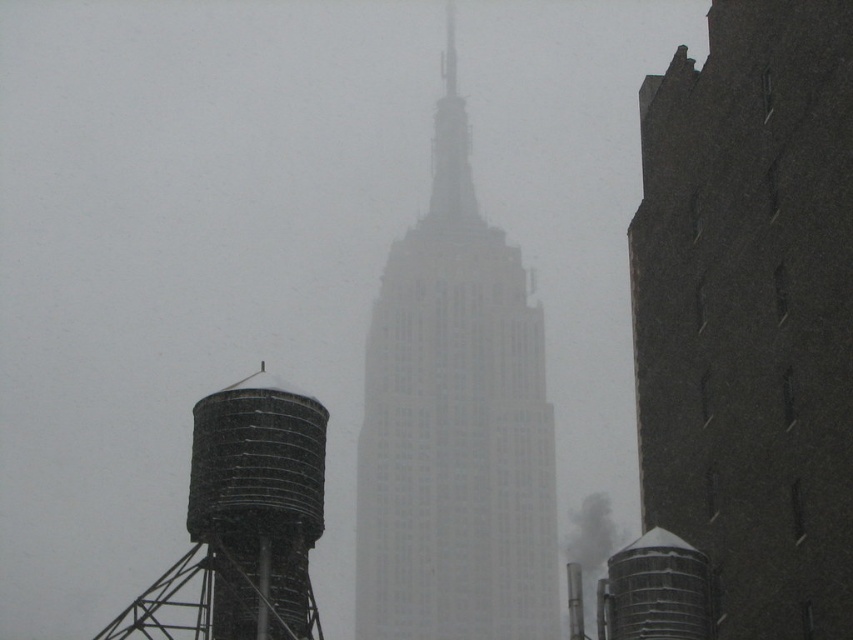
You are a photographer planning to capture the Empire State Building in the background with both the white glass tower at center and the rusty metal water tower at lower left in the frame. Which tower should you position closer to the camera to ensure both are fully visible in the photo?

To ensure both the white glass tower at center and the rusty metal water tower at lower left are fully visible, position the white glass tower at center closer to the camera since it is wider. This way, its larger width will be accommodated in the frame while the narrower rusty metal water tower at lower left can be placed further back without cropping.

You are a photographer trying to capture the Empire State Building in the background. You notice the white glass tower at center and the rusty metal water tower at lower left in your shot. Which object is blocking your view of the Empire State Building?

The rusty metal water tower at lower left is behind the white glass tower at center, so the white glass tower at center is blocking the view of the Empire State Building.